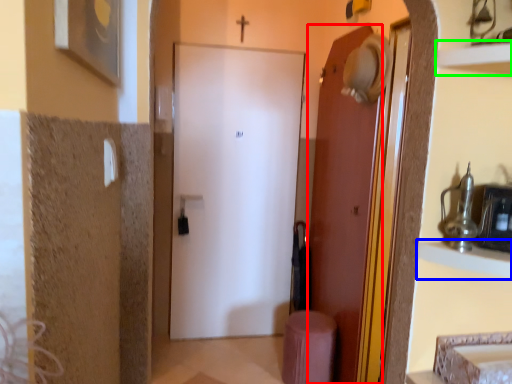
Question: Based on their relative distances, which object is farther from door (highlighted by a red box)? Choose from cabinet (highlighted by a blue box) and shelf (highlighted by a green box).

Choices:
 (A) cabinet
 (B) shelf

Answer: (B)